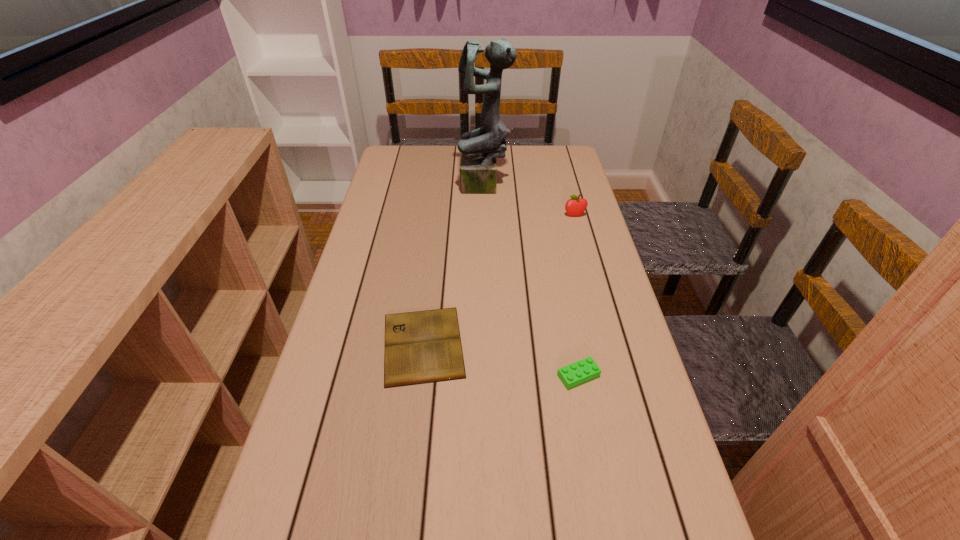
Find the location of `vacant space located 0.050m on the left of the rightmost object`. vacant space located 0.050m on the left of the rightmost object is located at coordinates (548, 215).

Image resolution: width=960 pixels, height=540 pixels. What are the coordinates of `free space located on the left of the third object from left to right` in the screenshot? It's located at (521, 376).

I want to click on free location located 0.320m on the right of the book, so click(x=602, y=345).

Where is `object situated at the far edge`? The image size is (960, 540). object situated at the far edge is located at coordinates (479, 148).

Where is `object at the left edge`? This screenshot has height=540, width=960. object at the left edge is located at coordinates (421, 347).

Where is `apple that is at the right edge`? apple that is at the right edge is located at coordinates (576, 206).

Where is `Lego located in the right edge section of the desktop`? This screenshot has height=540, width=960. Lego located in the right edge section of the desktop is located at coordinates (584, 370).

Find the location of a particular element. vacant space at the left edge of the desktop is located at coordinates (383, 202).

The width and height of the screenshot is (960, 540). I want to click on vacant space at the right edge of the desktop, so [x=592, y=220].

I want to click on free spot between the rightmost object and the Lego, so click(577, 295).